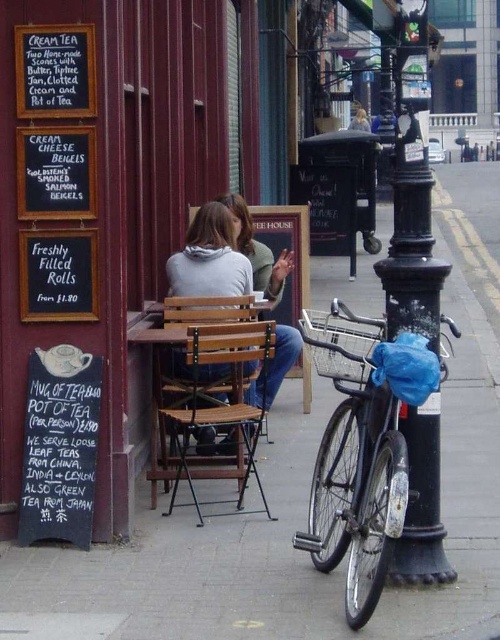
Between point (360, 579) and point (91, 376), which one is positioned in front?

Positioned in front is point (360, 579).

This screenshot has height=640, width=500. What do you see at coordinates (356, 460) in the screenshot?
I see `black matte bicycle at right` at bounding box center [356, 460].

Find the location of a particular element. Image resolution: width=500 pixels, height=640 pixels. black matte bicycle at right is located at coordinates (356, 460).

Who is more forward, (420,323) or (231,282)?

Point (420,323) is more forward.

Is black metal pole at right to the left of matte gray hoodie at center from the viewer's perspective?

Incorrect, black metal pole at right is not on the left side of matte gray hoodie at center.

I want to click on black metal pole at right, so click(x=412, y=189).

Find the location of a particular element. black metal pole at right is located at coordinates (412, 189).

Which is more to the right, wooden bench at center or matte gray hoodie at center?

matte gray hoodie at center

Who is positioned more to the left, wooden bench at center or matte gray hoodie at center?

From the viewer's perspective, wooden bench at center appears more on the left side.

Where is `wooden bench at center`? wooden bench at center is located at coordinates (184, 380).